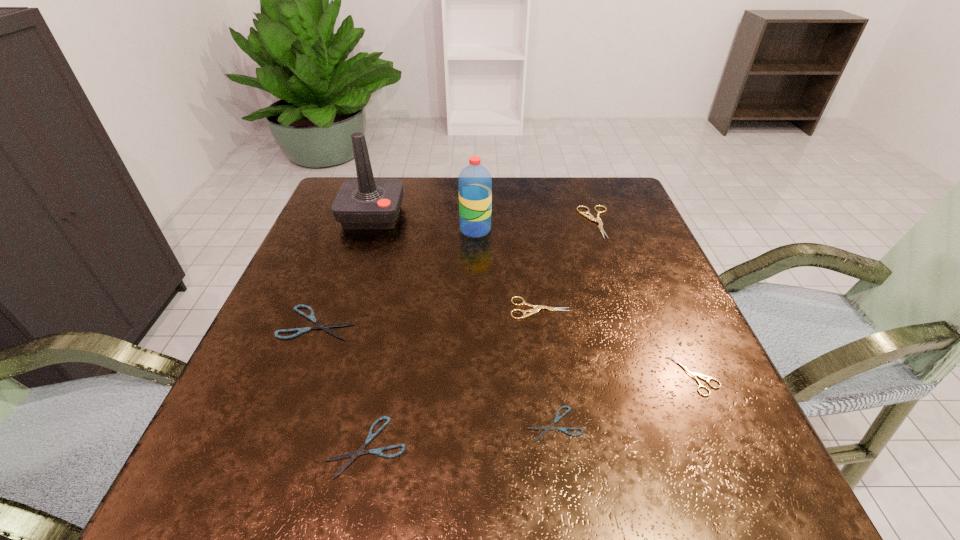
What are the coordinates of `joystick` in the screenshot? It's located at (365, 203).

Locate an element on the screen. Image resolution: width=960 pixels, height=540 pixels. the fifth object from right to left is located at coordinates (475, 182).

You are a GUI agent. You are given a task and a screenshot of the screen. Output one action in this format:
    pyautogui.click(x=<x>, y=<y>)
    Task: Click on the water bottle
    This screenshot has width=960, height=540.
    Given the screenshot: What is the action you would take?
    pyautogui.click(x=475, y=182)

The height and width of the screenshot is (540, 960). Identify the location of the second shears from right to left. (590, 217).

This screenshot has width=960, height=540. In order to click on the second object from right to left in this screenshot , I will do `click(590, 217)`.

Locate an element on the screen. the second tallest shears is located at coordinates (536, 309).

Identify the location of the second nearest beige shears. This screenshot has height=540, width=960. (536, 309).

Where is `the leftmost shears`? This screenshot has height=540, width=960. the leftmost shears is located at coordinates (311, 317).

Find the location of a particular element. The width and height of the screenshot is (960, 540). the biggest black shears is located at coordinates click(311, 317).

This screenshot has width=960, height=540. What are the coordinates of `the nearest beige shears` in the screenshot? It's located at (692, 374).